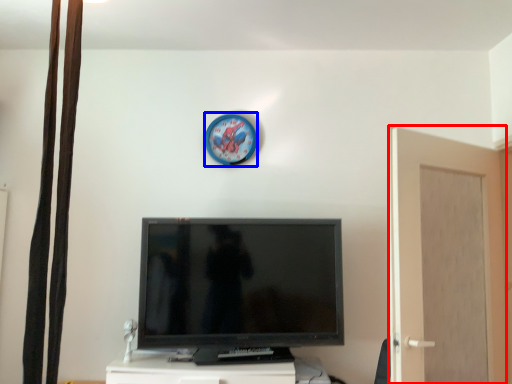
Question: Among these objects, which one is farthest to the camera, screen door (highlighted by a red box) or clock (highlighted by a blue box)?

Choices:
 (A) screen door
 (B) clock

Answer: (B)